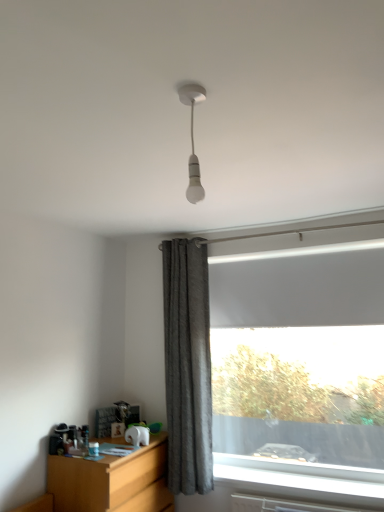
Question: Is white matte bulb at upper center outside gray textured curtain at center?

Choices:
 (A) no
 (B) yes

Answer: (B)

Question: Is white matte bulb at upper center further to camera compared to gray textured curtain at center?

Choices:
 (A) no
 (B) yes

Answer: (A)

Question: Can you confirm if white matte bulb at upper center is wider than gray textured curtain at center?

Choices:
 (A) yes
 (B) no

Answer: (B)

Question: Considering the relative positions of white matte bulb at upper center and gray textured curtain at center in the image provided, is white matte bulb at upper center in front of gray textured curtain at center?

Choices:
 (A) no
 (B) yes

Answer: (B)

Question: Can you confirm if white matte bulb at upper center is thinner than gray textured curtain at center?

Choices:
 (A) no
 (B) yes

Answer: (B)

Question: Considering the relative positions of white matte bulb at upper center and gray textured curtain at center in the image provided, is white matte bulb at upper center to the left of gray textured curtain at center from the viewer's perspective?

Choices:
 (A) yes
 (B) no

Answer: (B)

Question: Considering the relative sizes of white matte bulb at upper center and wooden at left in the image provided, is white matte bulb at upper center smaller than wooden at left?

Choices:
 (A) no
 (B) yes

Answer: (B)

Question: Is the depth of white matte bulb at upper center less than that of wooden at left?

Choices:
 (A) no
 (B) yes

Answer: (B)

Question: Can you confirm if white matte bulb at upper center is taller than wooden at left?

Choices:
 (A) no
 (B) yes

Answer: (A)

Question: Would you say white matte bulb at upper center is a long distance from wooden at left?

Choices:
 (A) yes
 (B) no

Answer: (A)

Question: From a real-world perspective, is white matte bulb at upper center positioned over wooden at left based on gravity?

Choices:
 (A) yes
 (B) no

Answer: (A)

Question: From the image's perspective, does white matte bulb at upper center appear higher than wooden at left?

Choices:
 (A) yes
 (B) no

Answer: (A)

Question: Is there a large distance between wooden at left and gray textured curtain at center?

Choices:
 (A) no
 (B) yes

Answer: (A)